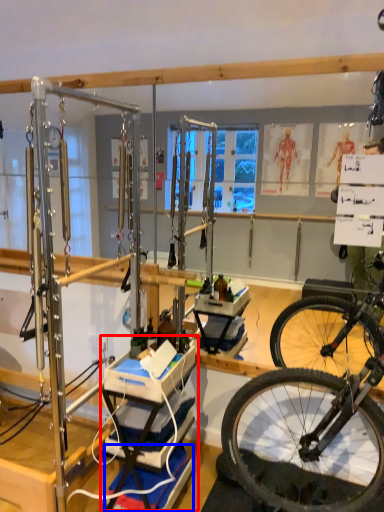
Question: Which object appears farthest to the camera in this image, workbench (highlighted by a red box) or yoga mat (highlighted by a blue box)?

Choices:
 (A) workbench
 (B) yoga mat

Answer: (B)